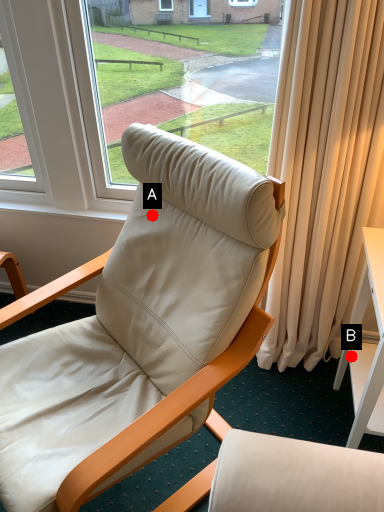
Question: Two points are circled on the image, labeled by A and B beside each circle. Among these points, which one is farthest from the camera?

Choices:
 (A) A is further
 (B) B is further

Answer: (B)